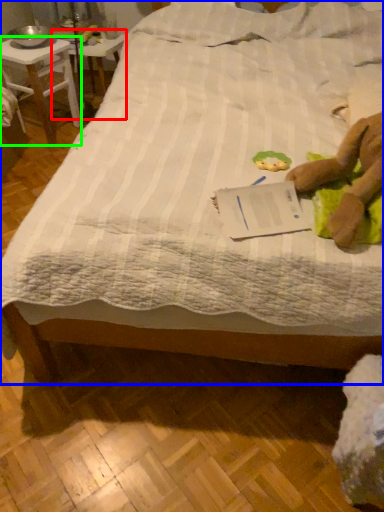
Question: Considering the real-world distances, which object is closest to table (highlighted by a red box)? bed (highlighted by a blue box) or desk (highlighted by a green box).

Choices:
 (A) bed
 (B) desk

Answer: (B)